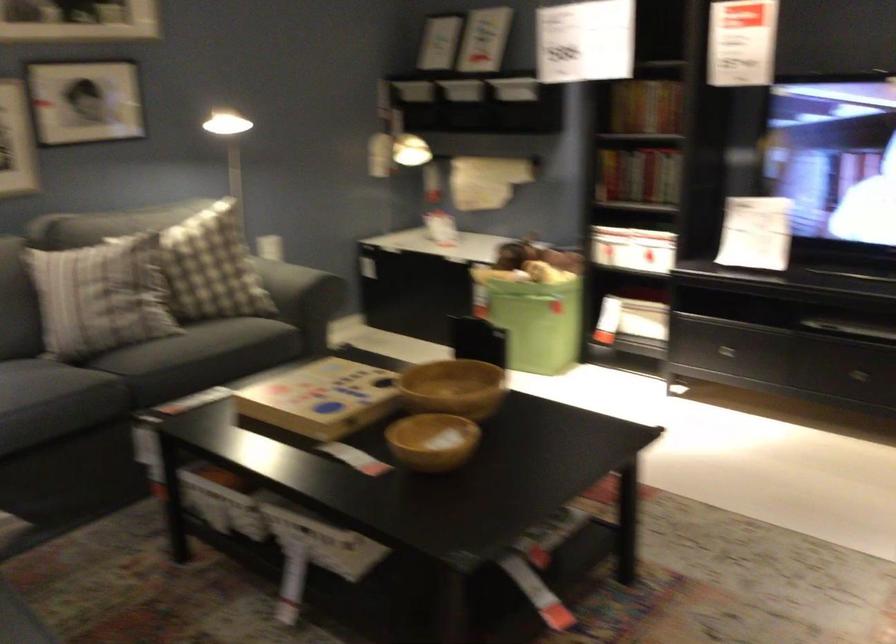
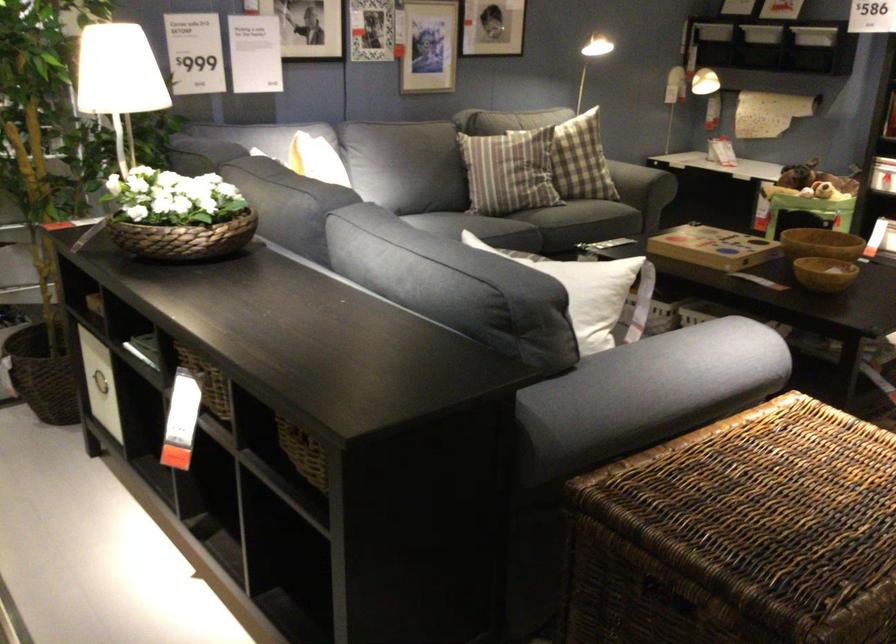
Where in the second image is the point corresponding to [414,397] from the first image?

(821, 243)